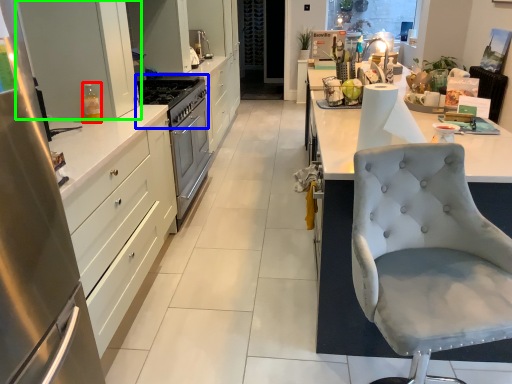
Question: Estimate the real-world distances between objects in this image. Which object is closer to bottle (highlighted by a red box), gas stove (highlighted by a blue box) or cabinetry (highlighted by a green box)?

Choices:
 (A) gas stove
 (B) cabinetry

Answer: (B)